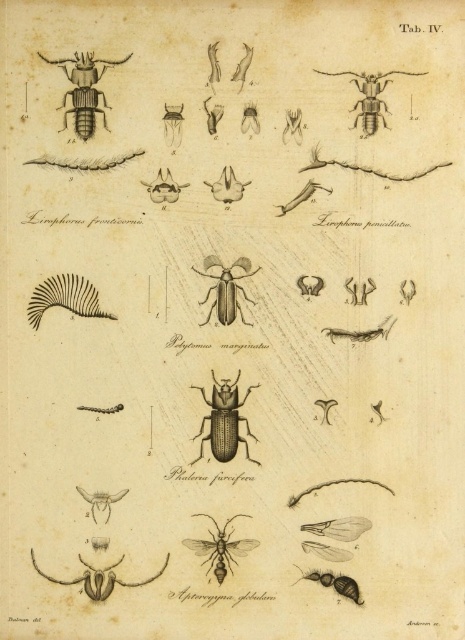
Who is more forward, (246, 264) or (369, 96)?

Point (369, 96)

Which is below, brown matte beetle at center or matte black beetle at upper right?

brown matte beetle at center

Locate an element on the screen. The width and height of the screenshot is (465, 640). brown matte beetle at center is located at coordinates (225, 289).

Between matte black beetle at upper left and shiny black beetle at lower right, which one is positioned higher?

matte black beetle at upper left

Based on the photo, does matte black beetle at upper left appear under shiny black beetle at lower right?

Actually, matte black beetle at upper left is above shiny black beetle at lower right.

Describe the element at coordinates (84, 90) in the screenshot. The image size is (465, 640). I see `matte black beetle at upper left` at that location.

Where is `matte black beetle at upper left`? This screenshot has height=640, width=465. matte black beetle at upper left is located at coordinates (84, 90).

From the picture: Is the position of brown matte beetle at center less distant than that of brown matte insect at center?

That is False.

Measure the distance between brown matte beetle at center and camera.

brown matte beetle at center and camera are 4.77 feet apart.

Where is `brown matte beetle at center`? The height and width of the screenshot is (640, 465). brown matte beetle at center is located at coordinates (225, 289).